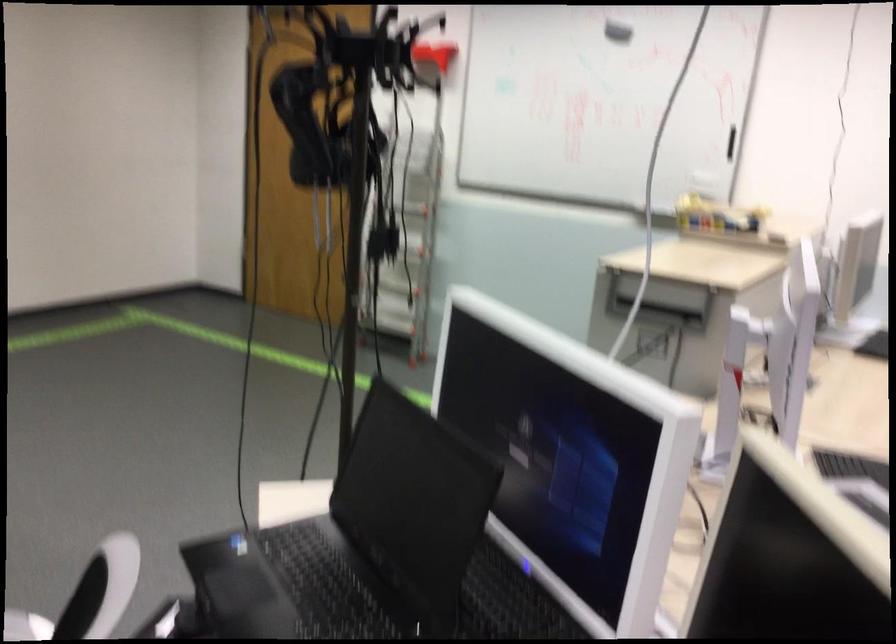
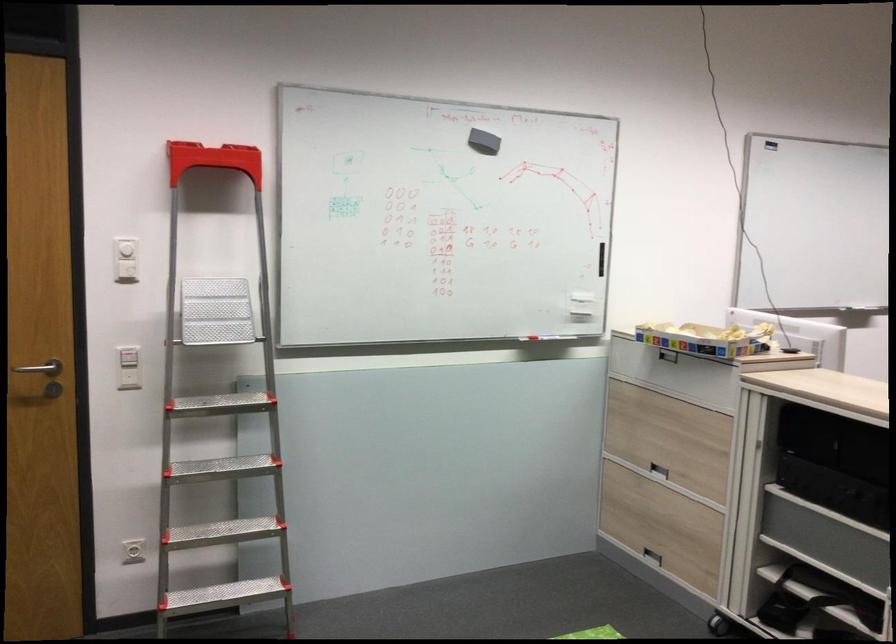
In the second image, find the point that corresponds to (691,204) in the first image.

(705, 339)